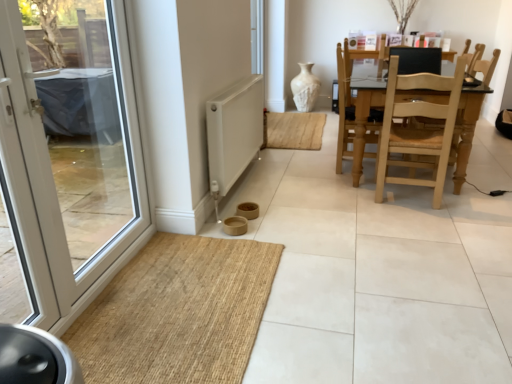
Question: Can you confirm if white textured vase at center is shorter than light brown wooden swivel chair at center?

Choices:
 (A) yes
 (B) no

Answer: (A)

Question: Is white textured vase at center beside light brown wooden swivel chair at center?

Choices:
 (A) yes
 (B) no

Answer: (B)

Question: Is white textured vase at center positioned before light brown wooden swivel chair at center?

Choices:
 (A) no
 (B) yes

Answer: (A)

Question: Does white textured vase at center have a greater height compared to light brown wooden swivel chair at center?

Choices:
 (A) yes
 (B) no

Answer: (B)

Question: Is light brown wooden swivel chair at center at the back of white textured vase at center?

Choices:
 (A) yes
 (B) no

Answer: (B)

Question: Is light brown wooden swivel chair at center situated inside white matte radiator at lower center or outside?

Choices:
 (A) inside
 (B) outside

Answer: (B)

Question: Considering the positions of light brown wooden swivel chair at center and white matte radiator at lower center in the image, is light brown wooden swivel chair at center taller or shorter than white matte radiator at lower center?

Choices:
 (A) tall
 (B) short

Answer: (A)

Question: Based on their positions, is light brown wooden swivel chair at center located to the left or right of white matte radiator at lower center?

Choices:
 (A) left
 (B) right

Answer: (B)

Question: From a real-world perspective, is light brown wooden swivel chair at center positioned above or below white matte radiator at lower center?

Choices:
 (A) above
 (B) below

Answer: (A)

Question: From a real-world perspective, relative to brown woven mat at lower left, is light brown wooden swivel chair at center vertically above or below?

Choices:
 (A) above
 (B) below

Answer: (A)

Question: From the image's perspective, is light brown wooden swivel chair at center located above or below brown woven mat at lower left?

Choices:
 (A) above
 (B) below

Answer: (A)

Question: Visually, is light brown wooden swivel chair at center positioned to the left or to the right of brown woven mat at lower left?

Choices:
 (A) left
 (B) right

Answer: (B)

Question: From their relative heights in the image, would you say light brown wooden swivel chair at center is taller or shorter than brown woven mat at lower left?

Choices:
 (A) tall
 (B) short

Answer: (A)

Question: Is white glass door at left in front of or behind light brown wooden swivel chair at center in the image?

Choices:
 (A) front
 (B) behind

Answer: (A)

Question: Is point (108, 125) closer or farther from the camera than point (336, 170)?

Choices:
 (A) closer
 (B) farther

Answer: (A)